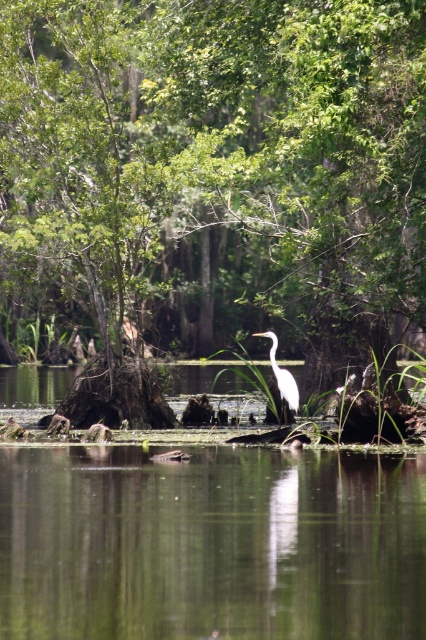
Question: Is green leafy tree at center smaller than clear water at center?

Choices:
 (A) yes
 (B) no

Answer: (B)

Question: Is green leafy tree at center to the right of white smooth heron at center from the viewer's perspective?

Choices:
 (A) yes
 (B) no

Answer: (B)

Question: Considering the real-world distances, which object is closest to the white smooth heron at center?

Choices:
 (A) clear water at center
 (B) green leafy tree at center

Answer: (A)

Question: Which point is farther to the camera?

Choices:
 (A) clear water at center
 (B) green leafy tree at center

Answer: (B)

Question: Is green leafy tree at center positioned in front of white smooth heron at center?

Choices:
 (A) no
 (B) yes

Answer: (B)

Question: Among these objects, which one is nearest to the camera?

Choices:
 (A) clear water at center
 (B) white smooth heron at center

Answer: (A)